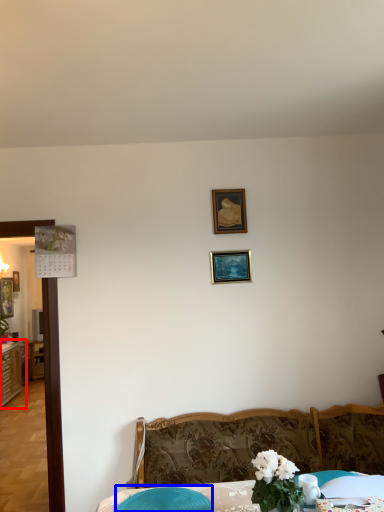
Question: Among these objects, which one is farthest to the camera, dresser (highlighted by a red box) or swivel chair (highlighted by a blue box)?

Choices:
 (A) dresser
 (B) swivel chair

Answer: (A)